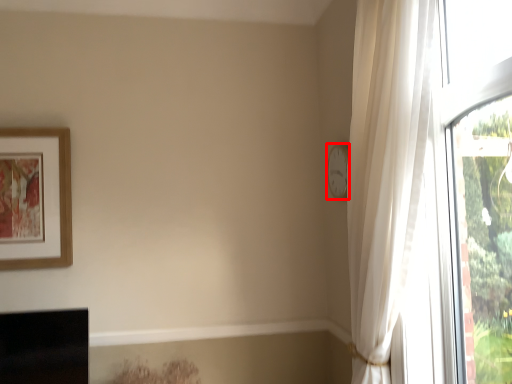
Question: From the image's perspective, what is the correct spatial relationship of clock (annotated by the red box) in relation to picture frame?

Choices:
 (A) above
 (B) below

Answer: (A)